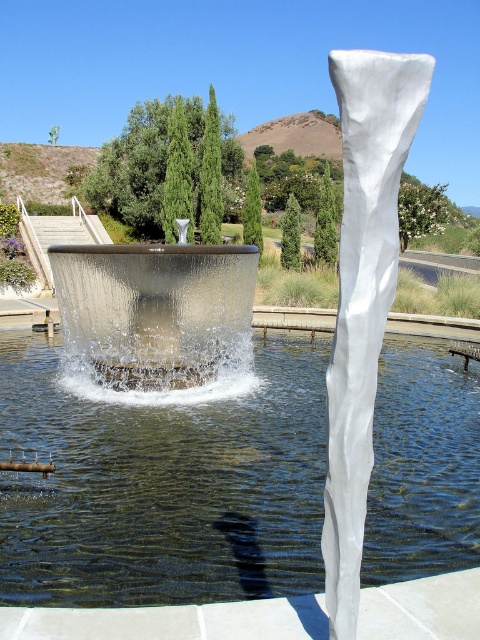
Between clear glass pool at center and translucent glass water at center, which one has less height?

With less height is clear glass pool at center.

Where is `clear glass pool at center`? This screenshot has width=480, height=640. clear glass pool at center is located at coordinates (163, 481).

Who is more distant from viewer, [432,499] or [141,324]?

The point [141,324] is behind.

Image resolution: width=480 pixels, height=640 pixels. Identify the location of clear glass pool at center. (163, 481).